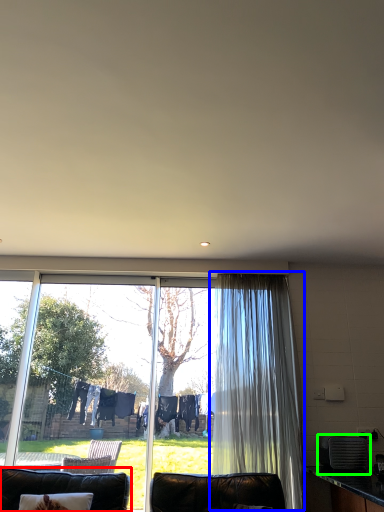
Question: Which is farther away from furniture (highlighted by a red box)? curtain (highlighted by a blue box) or appliance (highlighted by a green box)?

Choices:
 (A) curtain
 (B) appliance

Answer: (B)